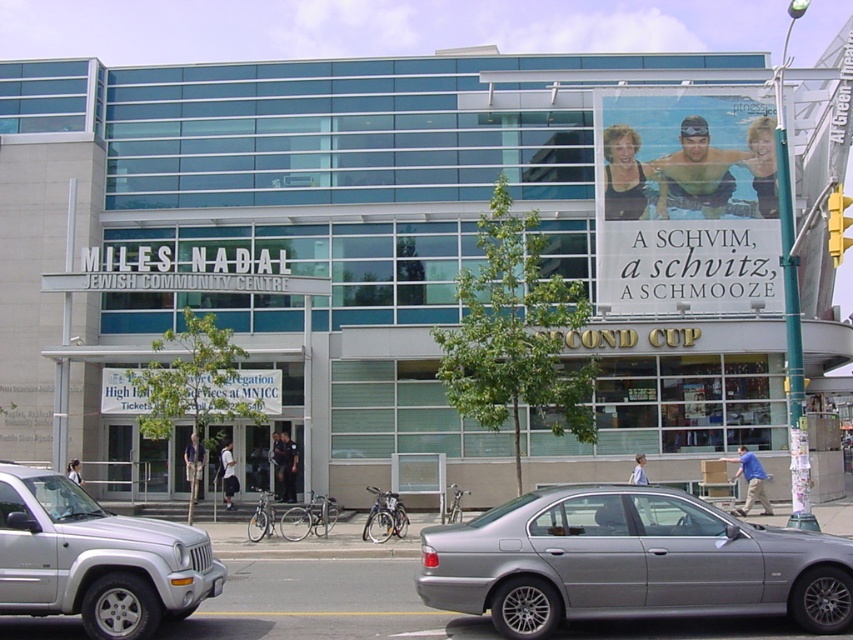
Question: Does silver metallic sedan at center appear on the left side of silver metallic suv at lower left?

Choices:
 (A) yes
 (B) no

Answer: (B)

Question: Can you confirm if silver metallic sedan at center is wider than matte plastic sign at upper right?

Choices:
 (A) yes
 (B) no

Answer: (B)

Question: Can you confirm if silver metallic sedan at center is wider than matte plastic sign at upper right?

Choices:
 (A) no
 (B) yes

Answer: (A)

Question: Which object appears closest to the camera in this image?

Choices:
 (A) matte plastic sign at upper right
 (B) silver metallic suv at lower left
 (C) silver metallic sedan at center

Answer: (B)

Question: Which of the following is the farthest from the observer?

Choices:
 (A) silver metallic suv at lower left
 (B) matte plastic sign at upper right
 (C) silver metallic sedan at center

Answer: (B)

Question: Considering the real-world distances, which object is farthest from the matte plastic sign at upper right?

Choices:
 (A) silver metallic sedan at center
 (B) silver metallic suv at lower left

Answer: (B)